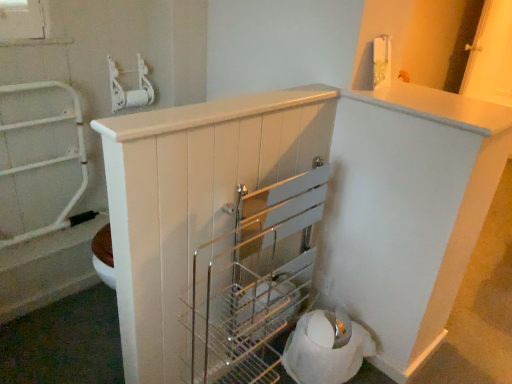
Question: Should I look upward or downward to see white matte counter top at upper right?

Choices:
 (A) down
 (B) up

Answer: (B)